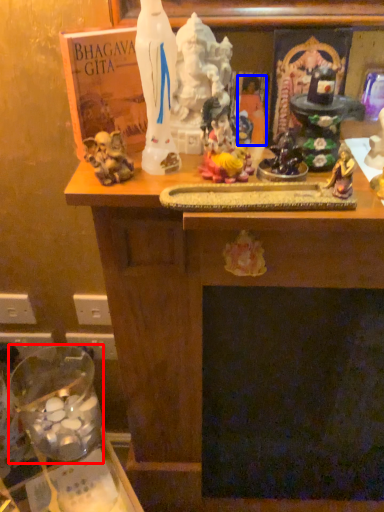
Question: Which of the following is the closest to the observer, glass jar (highlighted by a red box) or person (highlighted by a blue box)?

Choices:
 (A) glass jar
 (B) person

Answer: (B)